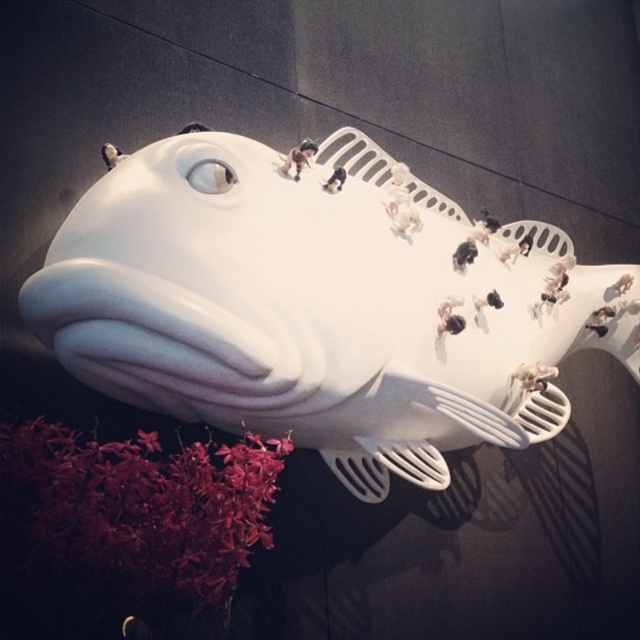
Question: Can you confirm if white glossy fish at center is thinner than velvety crimson blooms at bottom left?

Choices:
 (A) yes
 (B) no

Answer: (B)

Question: Can you confirm if white glossy fish at center is smaller than velvety crimson blooms at bottom left?

Choices:
 (A) yes
 (B) no

Answer: (B)

Question: Which of the following is the farthest from the observer?

Choices:
 (A) (84, 204)
 (B) (260, 460)

Answer: (A)

Question: Among these points, which one is nearest to the camera?

Choices:
 (A) coord(92,198)
 (B) coord(179,454)

Answer: (A)

Question: Is white glossy fish at center behind velvety crimson blooms at bottom left?

Choices:
 (A) yes
 (B) no

Answer: (A)